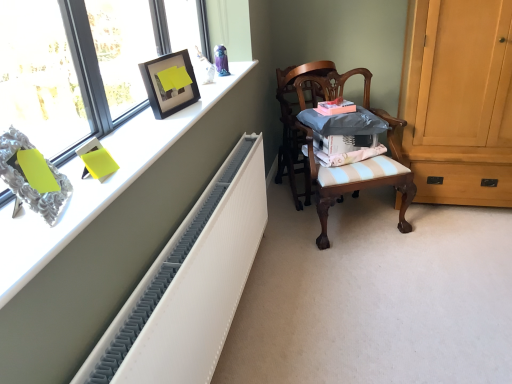
Locate an element on the screen. free space in front of wooden chair at center, placed as the 1th chair when sorted from front to back is located at coordinates (374, 271).